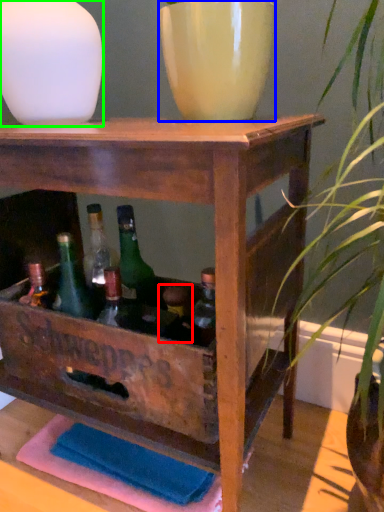
Question: Which is nearer to the bottle (highlighted by a red box)? flowerpot (highlighted by a blue box) or vase (highlighted by a green box).

Choices:
 (A) flowerpot
 (B) vase

Answer: (A)